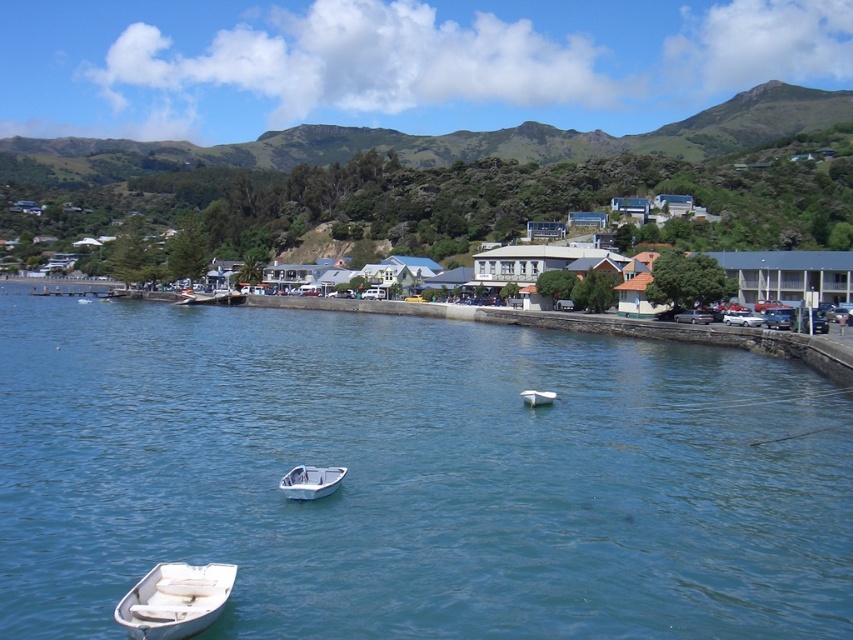
Question: Does blue glossy water at center have a greater width compared to white plastic boat at center?

Choices:
 (A) no
 (B) yes

Answer: (B)

Question: Where is white matte boat at lower left located in relation to white plastic boat at center in the image?

Choices:
 (A) right
 (B) left

Answer: (B)

Question: Which of the following is the farthest from the observer?

Choices:
 (A) pyautogui.click(x=173, y=563)
 (B) pyautogui.click(x=524, y=390)
 (C) pyautogui.click(x=312, y=486)
 (D) pyautogui.click(x=769, y=572)

Answer: (B)

Question: Based on their relative distances, which object is nearer to the white plastic boat at center?

Choices:
 (A) blue glossy water at center
 (B) white matte boat at lower left
 (C) white matte boat at center

Answer: (B)

Question: Does white plastic boat at center have a smaller size compared to white matte boat at center?

Choices:
 (A) no
 (B) yes

Answer: (A)

Question: Estimate the real-world distances between objects in this image. Which object is farther from the white matte boat at center?

Choices:
 (A) white plastic boat at center
 (B) blue glossy water at center

Answer: (A)